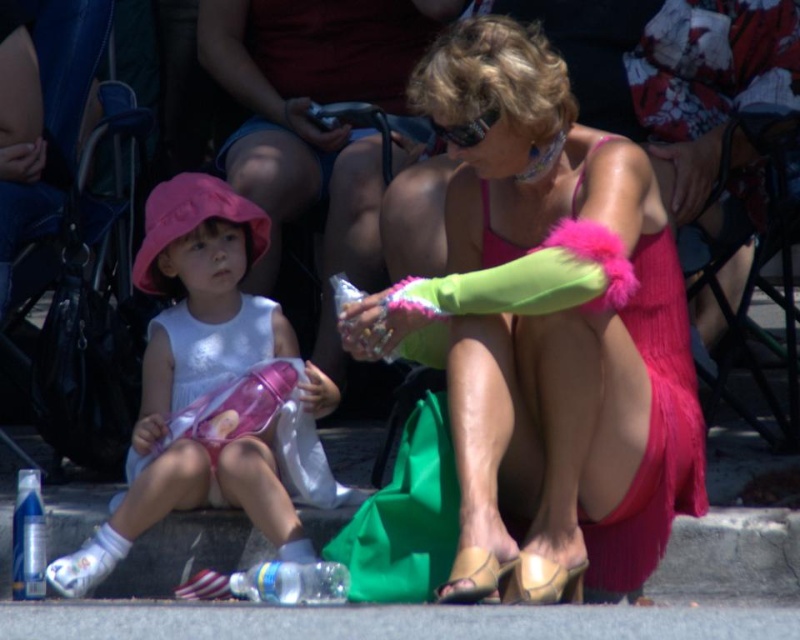
Please provide the 2D coordinates of the pink fuzzy arm at center in the image. The coordinates should be in the format of a tuple with two decimal numbers separated by a comma, like this example format of the answer would be something like 0.5,0.5. Please do not add any extra text or explanation, just the coordinates.

[550,317]

You are a parent trying to put shoes on your child. You have two options on the ground near the child. Which sandal, the tan leather sandal at lower center or the matte gold sandal at lower center, has a wider base and would be easier to slip on quickly?

The tan leather sandal at lower center might be wider than matte gold sandal at lower center, so it would be easier to slip on quickly.